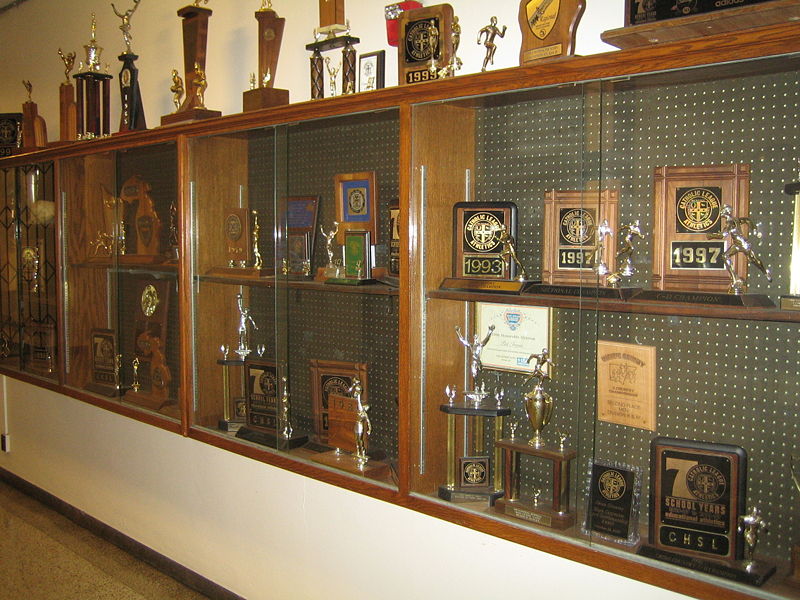
Locate an element on the screen. trophies is located at coordinates (544, 35).